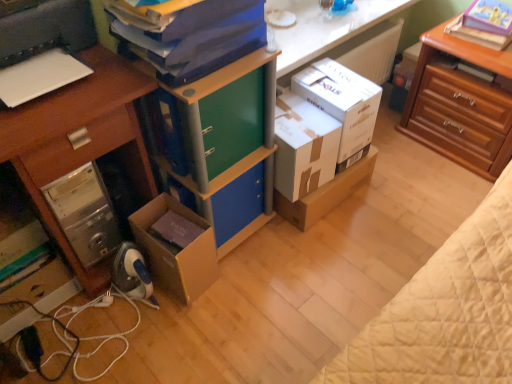
The image size is (512, 384). I want to click on free space in front of white cardboard box at center, so click(329, 254).